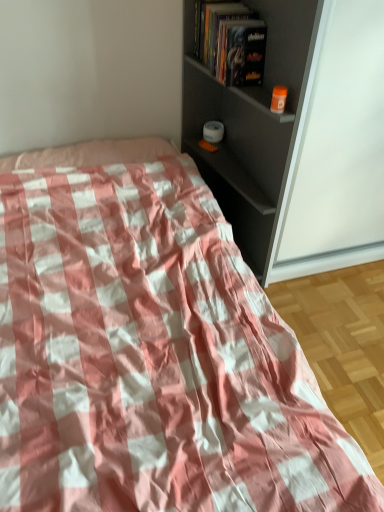
Question: Considering the relative sizes of hardcover book at upper center and matte gray shelf at upper right in the image provided, is hardcover book at upper center thinner than matte gray shelf at upper right?

Choices:
 (A) yes
 (B) no

Answer: (A)

Question: Does hardcover book at upper center turn towards matte gray shelf at upper right?

Choices:
 (A) yes
 (B) no

Answer: (A)

Question: Is hardcover book at upper center facing away from matte gray shelf at upper right?

Choices:
 (A) no
 (B) yes

Answer: (B)

Question: Can you confirm if hardcover book at upper center is taller than matte gray shelf at upper right?

Choices:
 (A) yes
 (B) no

Answer: (B)

Question: From the image's perspective, is hardcover book at upper center under matte gray shelf at upper right?

Choices:
 (A) yes
 (B) no

Answer: (B)

Question: Looking at the image, does pink checkered fabric at center seem bigger or smaller compared to hardcover book at upper center?

Choices:
 (A) small
 (B) big

Answer: (B)

Question: Is pink checkered fabric at center situated inside hardcover book at upper center or outside?

Choices:
 (A) outside
 (B) inside

Answer: (A)

Question: From the image's perspective, relative to hardcover book at upper center, is pink checkered fabric at center above or below?

Choices:
 (A) below
 (B) above

Answer: (A)

Question: Based on their positions, is pink checkered fabric at center located to the left or right of hardcover book at upper center?

Choices:
 (A) right
 (B) left

Answer: (B)

Question: Based on their sizes in the image, would you say matte gray shelf at upper right is bigger or smaller than hardcover book at upper center?

Choices:
 (A) big
 (B) small

Answer: (A)

Question: From the image's perspective, is matte gray shelf at upper right above or below hardcover book at upper center?

Choices:
 (A) above
 (B) below

Answer: (B)

Question: In terms of width, does matte gray shelf at upper right look wider or thinner when compared to hardcover book at upper center?

Choices:
 (A) wide
 (B) thin

Answer: (A)

Question: Visually, is matte gray shelf at upper right positioned to the left or to the right of hardcover book at upper center?

Choices:
 (A) right
 (B) left

Answer: (B)

Question: Considering the positions of hardcover book at upper center and matte gray shelf at upper right in the image, is hardcover book at upper center taller or shorter than matte gray shelf at upper right?

Choices:
 (A) short
 (B) tall

Answer: (A)

Question: Considering the positions of hardcover book at upper center and matte gray shelf at upper right in the image, is hardcover book at upper center wider or thinner than matte gray shelf at upper right?

Choices:
 (A) thin
 (B) wide

Answer: (A)